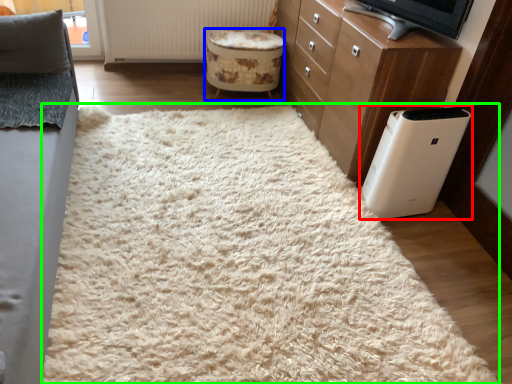
Question: Estimate the real-world distances between objects in this image. Which object is farther from home appliance (highlighted by a red box), stool (highlighted by a blue box) or mat (highlighted by a green box)?

Choices:
 (A) stool
 (B) mat

Answer: (A)